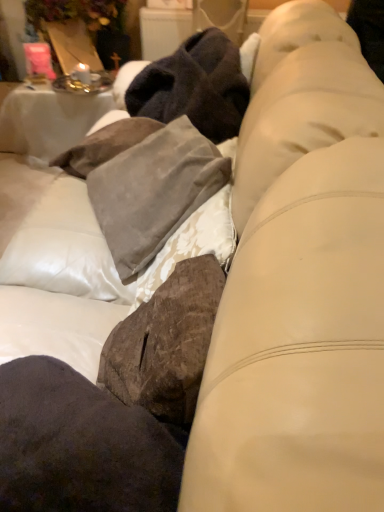
Question: Can you confirm if suede pillow at center is taller than white clothed table at upper left?

Choices:
 (A) yes
 (B) no

Answer: (B)

Question: Is white clothed table at upper left surrounded by suede pillow at center?

Choices:
 (A) no
 (B) yes

Answer: (A)

Question: Does suede pillow at center appear on the right side of white clothed table at upper left?

Choices:
 (A) yes
 (B) no

Answer: (A)

Question: From a real-world perspective, is suede pillow at center located higher than white clothed table at upper left?

Choices:
 (A) yes
 (B) no

Answer: (A)

Question: Can you confirm if suede pillow at center is thinner than white clothed table at upper left?

Choices:
 (A) yes
 (B) no

Answer: (A)

Question: Is suede pillow at center next to white clothed table at upper left and touching it?

Choices:
 (A) yes
 (B) no

Answer: (B)

Question: From a real-world perspective, is white clothed table at upper left on suede pillow at center?

Choices:
 (A) yes
 (B) no

Answer: (B)

Question: From the image's perspective, is white clothed table at upper left under suede pillow at center?

Choices:
 (A) yes
 (B) no

Answer: (B)

Question: From a real-world perspective, is white clothed table at upper left physically below suede pillow at center?

Choices:
 (A) no
 (B) yes

Answer: (B)

Question: Is white clothed table at upper left wider than suede pillow at center?

Choices:
 (A) no
 (B) yes

Answer: (B)

Question: Can you confirm if white clothed table at upper left is shorter than suede pillow at center?

Choices:
 (A) no
 (B) yes

Answer: (A)

Question: Could you tell me if white clothed table at upper left is turned towards suede pillow at center?

Choices:
 (A) no
 (B) yes

Answer: (B)

Question: From the image's perspective, is dark brown suede pillow at lower left on top of suede pillow at center?

Choices:
 (A) yes
 (B) no

Answer: (B)